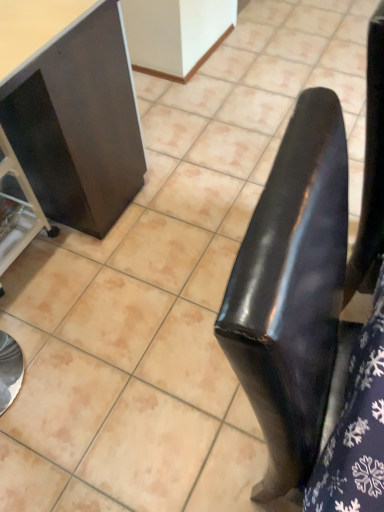
Describe the element at coordinates (17, 209) in the screenshot. I see `metallic silver cart at left, the 1th furniture positioned from the left` at that location.

Where is `metallic silver cart at left, the 2th furniture when ordered from right to left`? The width and height of the screenshot is (384, 512). metallic silver cart at left, the 2th furniture when ordered from right to left is located at coordinates pos(17,209).

How much space does matte black cabinet at left, placed as the 2th furniture when sorted from left to right, occupy vertically?

It is 87.42 centimeters.

Measure the distance between point (26, 169) and camera.

Point (26, 169) is 1.58 meters from camera.

This screenshot has width=384, height=512. I want to click on matte black cabinet at left, placed as the 2th furniture when sorted from left to right, so click(x=78, y=124).

The image size is (384, 512). Describe the element at coordinates (78, 124) in the screenshot. I see `matte black cabinet at left, placed as the 2th furniture when sorted from left to right` at that location.

At what (x,y) coordinates should I click in order to perform the action: click on metallic silver cart at left, the 2th furniture when ordered from right to left. Please return your answer as a coordinate pair (x, y). Image resolution: width=384 pixels, height=512 pixels. Looking at the image, I should click on (17, 209).

Consider the image. Considering the positions of objects metallic silver cart at left, the 2th furniture when ordered from right to left, and matte black cabinet at left, placed as the 2th furniture when sorted from left to right, in the image provided, who is more to the left, metallic silver cart at left, the 2th furniture when ordered from right to left, or matte black cabinet at left, placed as the 2th furniture when sorted from left to right,?

Positioned to the left is metallic silver cart at left, the 2th furniture when ordered from right to left.

Is the position of metallic silver cart at left, the 2th furniture when ordered from right to left, more distant than that of matte black cabinet at left, placed as the 2th furniture when sorted from left to right?

That is True.

Is point (31, 234) closer to viewer compared to point (121, 42)?

No, it is not.

From the image's perspective, is metallic silver cart at left, the 1th furniture positioned from the left, above or below matte black cabinet at left, placed as the first furniture when sorted from right to left?

metallic silver cart at left, the 1th furniture positioned from the left, is below matte black cabinet at left, placed as the first furniture when sorted from right to left.

Looking at this image, from a real-world perspective, is metallic silver cart at left, the 1th furniture positioned from the left, over matte black cabinet at left, placed as the 2th furniture when sorted from left to right?

Actually, metallic silver cart at left, the 1th furniture positioned from the left, is physically below matte black cabinet at left, placed as the 2th furniture when sorted from left to right, in the real world.

Considering the relative sizes of metallic silver cart at left, the 1th furniture positioned from the left, and matte black cabinet at left, placed as the first furniture when sorted from right to left, in the image provided, is metallic silver cart at left, the 1th furniture positioned from the left, wider than matte black cabinet at left, placed as the first furniture when sorted from right to left,?

No, metallic silver cart at left, the 1th furniture positioned from the left, is not wider than matte black cabinet at left, placed as the first furniture when sorted from right to left.

Does metallic silver cart at left, the 1th furniture positioned from the left, have a lesser height compared to matte black cabinet at left, placed as the first furniture when sorted from right to left?

Yes.

Considering the relative sizes of metallic silver cart at left, the 1th furniture positioned from the left, and matte black cabinet at left, placed as the first furniture when sorted from right to left, in the image provided, is metallic silver cart at left, the 1th furniture positioned from the left, bigger than matte black cabinet at left, placed as the first furniture when sorted from right to left,?

Actually, metallic silver cart at left, the 1th furniture positioned from the left, might be smaller than matte black cabinet at left, placed as the first furniture when sorted from right to left.

Based on the photo, is metallic silver cart at left, the 1th furniture positioned from the left, surrounding matte black cabinet at left, placed as the 2th furniture when sorted from left to right?

No, matte black cabinet at left, placed as the 2th furniture when sorted from left to right, is not surrounded by metallic silver cart at left, the 1th furniture positioned from the left.

Is metallic silver cart at left, the 2th furniture when ordered from right to left, not close to matte black cabinet at left, placed as the 2th furniture when sorted from left to right?

No, metallic silver cart at left, the 2th furniture when ordered from right to left, is in close proximity to matte black cabinet at left, placed as the 2th furniture when sorted from left to right.

Is metallic silver cart at left, the 2th furniture when ordered from right to left, aimed at matte black cabinet at left, placed as the 2th furniture when sorted from left to right?

Yes, metallic silver cart at left, the 2th furniture when ordered from right to left, is oriented towards matte black cabinet at left, placed as the 2th furniture when sorted from left to right.

How far apart are metallic silver cart at left, the 1th furniture positioned from the left, and matte black cabinet at left, placed as the 2th furniture when sorted from left to right?

metallic silver cart at left, the 1th furniture positioned from the left, and matte black cabinet at left, placed as the 2th furniture when sorted from left to right, are 9.18 inches apart.

This screenshot has width=384, height=512. I want to click on furniture located behind the matte black cabinet at left, placed as the 2th furniture when sorted from left to right, so click(x=17, y=209).

Considering the relative positions of matte black cabinet at left, placed as the 2th furniture when sorted from left to right, and metallic silver cart at left, the 1th furniture positioned from the left, in the image provided, is matte black cabinet at left, placed as the 2th furniture when sorted from left to right, to the left of metallic silver cart at left, the 1th furniture positioned from the left, from the viewer's perspective?

No.

Is matte black cabinet at left, placed as the first furniture when sorted from right to left, in front of or behind metallic silver cart at left, the 2th furniture when ordered from right to left, in the image?

Clearly, matte black cabinet at left, placed as the first furniture when sorted from right to left, is in front of metallic silver cart at left, the 2th furniture when ordered from right to left.

Is point (52, 190) farther from viewer compared to point (7, 170)?

Yes, point (52, 190) is behind point (7, 170).

From the image's perspective, between matte black cabinet at left, placed as the 2th furniture when sorted from left to right, and metallic silver cart at left, the 1th furniture positioned from the left, which one is located above?

matte black cabinet at left, placed as the 2th furniture when sorted from left to right, from the image's perspective.

From a real-world perspective, which object stands above the other?

From a 3D spatial view, matte black cabinet at left, placed as the first furniture when sorted from right to left, is above.

Which object is thinner, matte black cabinet at left, placed as the first furniture when sorted from right to left, or metallic silver cart at left, the 2th furniture when ordered from right to left?

metallic silver cart at left, the 2th furniture when ordered from right to left.

Does matte black cabinet at left, placed as the 2th furniture when sorted from left to right, have a lesser height compared to metallic silver cart at left, the 1th furniture positioned from the left?

No, matte black cabinet at left, placed as the 2th furniture when sorted from left to right, is not shorter than metallic silver cart at left, the 1th furniture positioned from the left.

Can you confirm if matte black cabinet at left, placed as the first furniture when sorted from right to left, is smaller than metallic silver cart at left, the 1th furniture positioned from the left?

No, matte black cabinet at left, placed as the first furniture when sorted from right to left, is not smaller than metallic silver cart at left, the 1th furniture positioned from the left.

Is matte black cabinet at left, placed as the first furniture when sorted from right to left, not inside metallic silver cart at left, the 1th furniture positioned from the left?

That's correct, matte black cabinet at left, placed as the first furniture when sorted from right to left, is outside of metallic silver cart at left, the 1th furniture positioned from the left.

Is matte black cabinet at left, placed as the first furniture when sorted from right to left, next to metallic silver cart at left, the 1th furniture positioned from the left?

They are not placed beside each other.

Is matte black cabinet at left, placed as the 2th furniture when sorted from left to right, facing towards metallic silver cart at left, the 2th furniture when ordered from right to left?

Yes, matte black cabinet at left, placed as the 2th furniture when sorted from left to right, is oriented towards metallic silver cart at left, the 2th furniture when ordered from right to left.

How different are the orientations of matte black cabinet at left, placed as the 2th furniture when sorted from left to right, and metallic silver cart at left, the 2th furniture when ordered from right to left, in degrees?

93.3 degrees separate the facing orientations of matte black cabinet at left, placed as the 2th furniture when sorted from left to right, and metallic silver cart at left, the 2th furniture when ordered from right to left.

Measure the distance from matte black cabinet at left, placed as the first furniture when sorted from right to left, to metallic silver cart at left, the 1th furniture positioned from the left.

matte black cabinet at left, placed as the first furniture when sorted from right to left, and metallic silver cart at left, the 1th furniture positioned from the left, are 9.18 inches apart from each other.

Where is `furniture below the matte black cabinet at left, placed as the 2th furniture when sorted from left to right (from the image's perspective)`? furniture below the matte black cabinet at left, placed as the 2th furniture when sorted from left to right (from the image's perspective) is located at coordinates (17, 209).

Where is `furniture on the right of metallic silver cart at left, the 2th furniture when ordered from right to left`? The height and width of the screenshot is (512, 384). furniture on the right of metallic silver cart at left, the 2th furniture when ordered from right to left is located at coordinates (x=78, y=124).

Where is `furniture in front of the metallic silver cart at left, the 1th furniture positioned from the left`? The image size is (384, 512). furniture in front of the metallic silver cart at left, the 1th furniture positioned from the left is located at coordinates (78, 124).